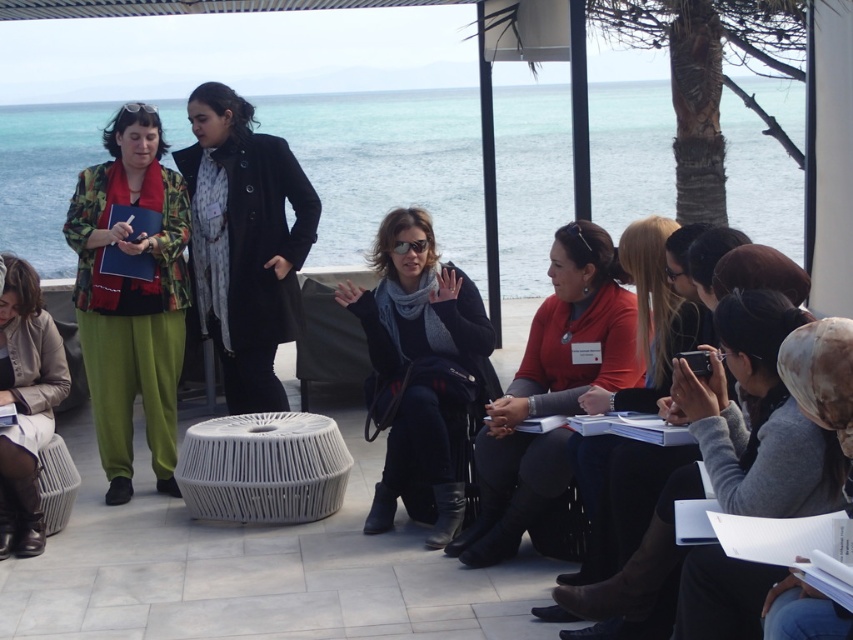
You are organizing a group photo and need to arrange the participants based on their sweater widths. If you have to place the gray knit sweater at lower right and the matte orange sweater at center in a line from narrowest to widest, which order should they be placed in?

The gray knit sweater at lower right should come first, followed by the matte orange sweater at center since the gray knit sweater at lower right is narrower than the matte orange sweater at center.

Looking at this image, you are standing at the point with coordinates point (839, 461) and want to move towards the point with coordinates point (543, 339). Which direction should you move in to get closer to the second point?

Since point (839, 461) is closer to the viewer than point (543, 339), you should move forward to get closer to the second point.